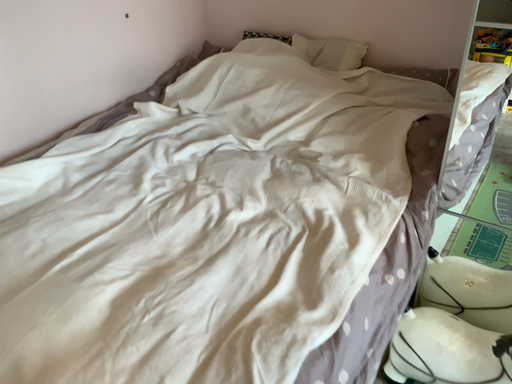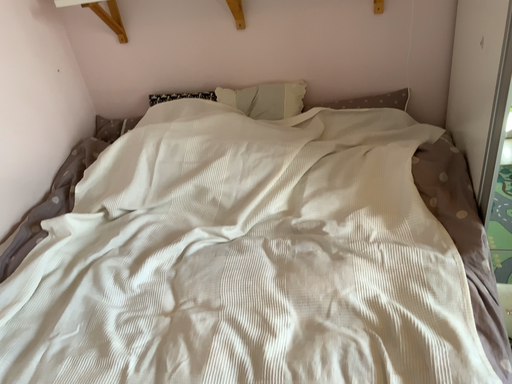
Question: Which way did the camera rotate in the video?

Choices:
 (A) rotated left
 (B) rotated right

Answer: (B)